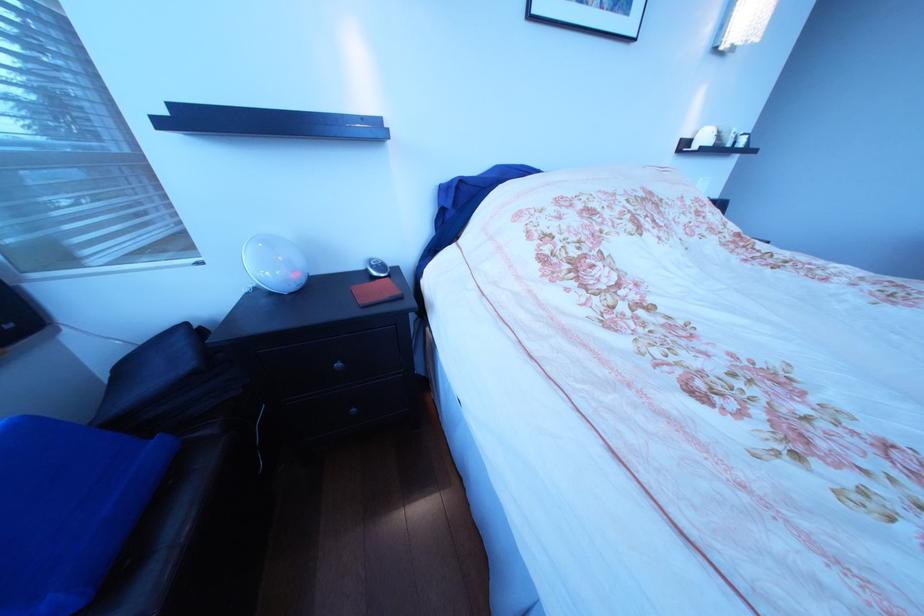
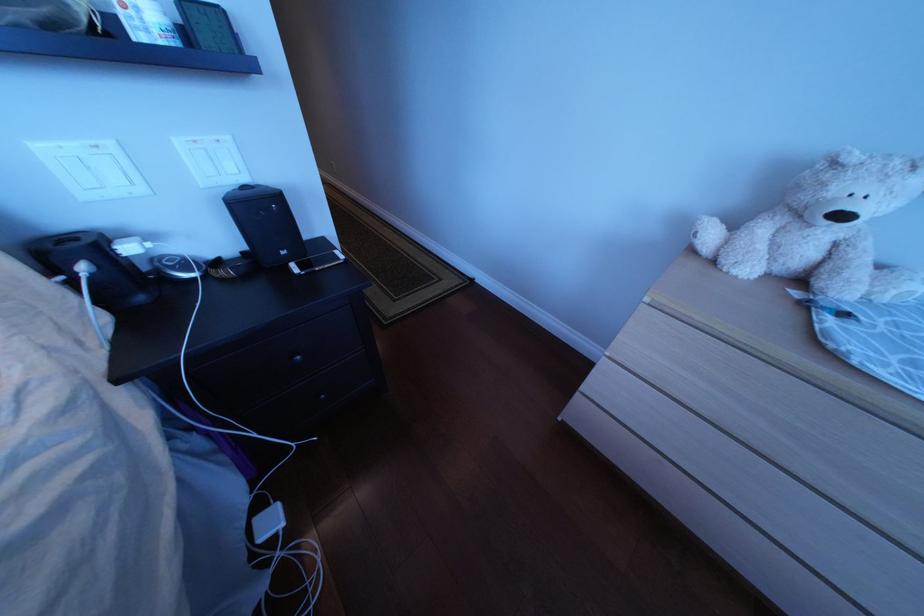
Which direction would the cameraman need to move to produce the second image?

The cameraman walked toward right, forward.